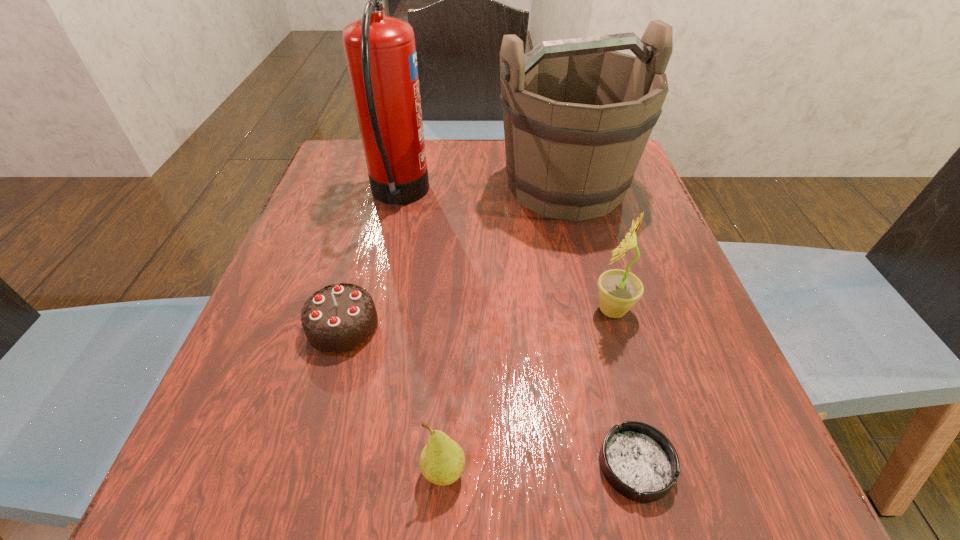
The width and height of the screenshot is (960, 540). Identify the location of free spot between the chocolate cake and the fourth shortest object. (477, 319).

You are a GUI agent. You are given a task and a screenshot of the screen. Output one action in this format:
    pyautogui.click(x=<x>, y=<y>)
    Task: Click on the free space that is in between the tallest object and the third shortest object
    The height and width of the screenshot is (540, 960).
    Given the screenshot: What is the action you would take?
    pyautogui.click(x=421, y=334)

The width and height of the screenshot is (960, 540). I want to click on object that stands as the third closest to the shortest object, so click(338, 319).

Where is `object that stands as the second closest to the fourth shortest object`? The width and height of the screenshot is (960, 540). object that stands as the second closest to the fourth shortest object is located at coordinates [x=577, y=114].

Find the location of a particular element. This screenshot has width=960, height=540. blank area in the image that satisfies the following two spatial constraints: 1. on the surface of the tallest object; 2. on the right side of the ashtray is located at coordinates (339, 465).

Identify the location of vacant region that satisfies the following two spatial constraints: 1. on the surface of the tallest object; 2. on the right side of the third shortest object. The width and height of the screenshot is (960, 540). tap(337, 471).

Where is `free space that satisfies the following two spatial constraints: 1. on the surface of the fire extinguisher; 2. on the right side of the fourth object from right to left`? This screenshot has width=960, height=540. free space that satisfies the following two spatial constraints: 1. on the surface of the fire extinguisher; 2. on the right side of the fourth object from right to left is located at coordinates (337, 471).

At what (x,y) coordinates should I click in order to perform the action: click on free space that satisfies the following two spatial constraints: 1. on the surface of the pear; 2. on the right side of the fire extinguisher. Please return your answer as a coordinate pair (x, y). Looking at the image, I should click on (337, 471).

Identify the location of blank area in the image that satisfies the following two spatial constraints: 1. on the back side of the shortest object; 2. on the surface of the tallest object. The width and height of the screenshot is (960, 540). (569, 196).

At what (x,y) coordinates should I click in order to perform the action: click on vacant position in the image that satisfies the following two spatial constraints: 1. on the face of the sunflower; 2. on the front side of the third object from left to right. Please return your answer as a coordinate pair (x, y). The width and height of the screenshot is (960, 540). Looking at the image, I should click on (657, 471).